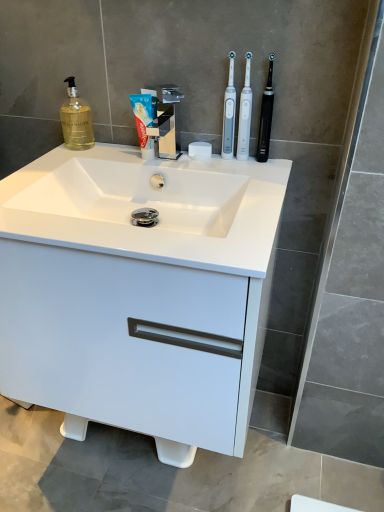
This screenshot has width=384, height=512. What are the coordinates of `vacant space that is in between translucent glass soap dispenser at upper left and white matte soap at center` in the screenshot? It's located at (120, 152).